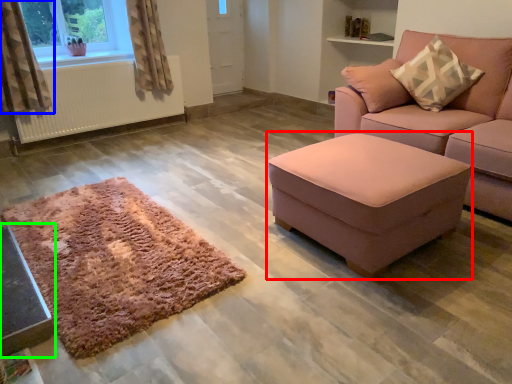
Question: Which is nearer to the table (highlighted by a red box)? curtain (highlighted by a blue box) or table (highlighted by a green box).

Choices:
 (A) curtain
 (B) table

Answer: (B)